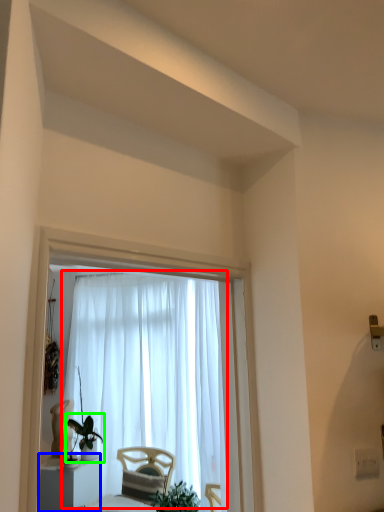
Question: Which object is positioned closest to curtain (highlighted by a red box)? Select from furniture (highlighted by a blue box) and houseplant (highlighted by a green box).

Choices:
 (A) furniture
 (B) houseplant

Answer: (B)